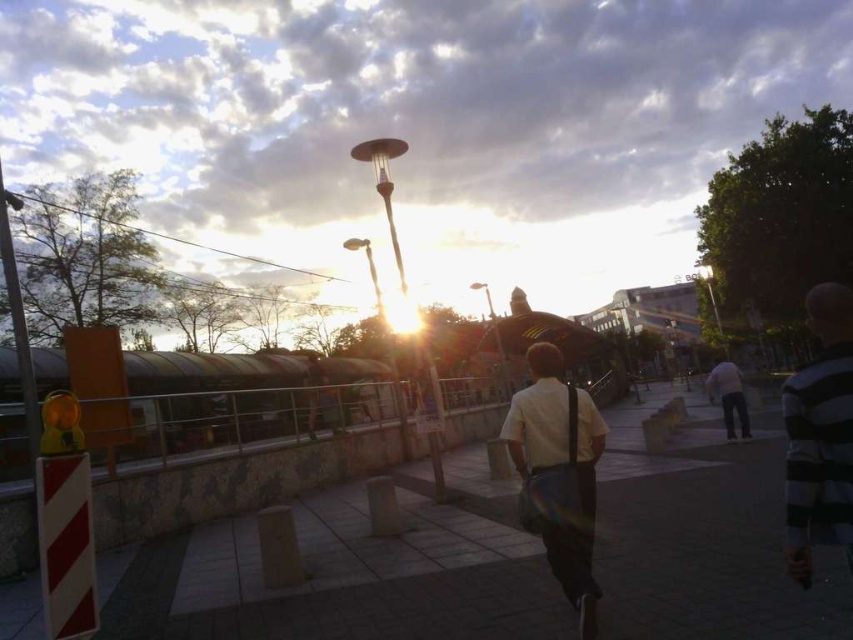
You are a photographer trying to capture both the white matte shirt at center and the striped cotton shirt at right in a single shot. Based on their positions, can you include both in your frame without moving the camera?

The striped cotton shirt at right is behind the white matte shirt at center, so yes, you can include both in your frame without moving the camera since they are layered in depth.

You are a photographer trying to capture both the white matte shirt at center and the striped cotton shirt at right in a single frame. Based on their sizes in the image, which one should you focus on first to ensure both are in focus?

The white matte shirt at center is smaller than the striped cotton shirt at right, so you should focus on the striped cotton shirt at right first to ensure both are in focus.

You are a photographer trying to capture the scene with a focus on the striped cotton shirt at right and the light gray jeans at center right. Which object should you zoom in on to get a clearer image of the clothing details?

The striped cotton shirt at right has a greater height compared to the light gray jeans at center right, so you should zoom in on the striped cotton shirt at right to capture its details more clearly.